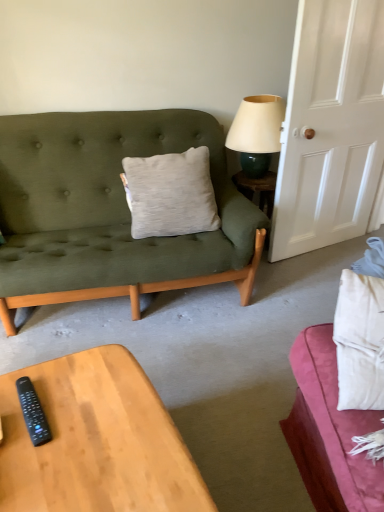
Image resolution: width=384 pixels, height=512 pixels. Find the location of `white matte door at right`. white matte door at right is located at coordinates (331, 127).

Locate an element on the screen. The image size is (384, 512). matte green glass lamp at upper right is located at coordinates [x=257, y=132].

Looking at this image, what is the approximate height of wooden coffee table at lower left?

wooden coffee table at lower left is 15.50 inches in height.

You are a GUI agent. You are given a task and a screenshot of the screen. Output one action in this format:
    pyautogui.click(x=<x>, y=<y>)
    Task: Click on the light gray cotton pillow at center
    The height and width of the screenshot is (512, 384).
    Given the screenshot: What is the action you would take?
    pyautogui.click(x=170, y=194)

Image resolution: width=384 pixels, height=512 pixels. Describe the element at coordinates (33, 412) in the screenshot. I see `black plastic remote at lower left` at that location.

Locate an element on the screen. white matte door at right is located at coordinates (331, 127).

Does white fabric studio couch at lower right have a greater height compared to black plastic remote at lower left?

Indeed, white fabric studio couch at lower right has a greater height compared to black plastic remote at lower left.

Is black plastic remote at lower left inside white fabric studio couch at lower right?

No, black plastic remote at lower left is not inside white fabric studio couch at lower right.

From the image's perspective, relative to black plastic remote at lower left, is white fabric studio couch at lower right above or below?

white fabric studio couch at lower right is situated higher than black plastic remote at lower left in the image.

Consider the image. Is white fabric studio couch at lower right next to black plastic remote at lower left?

white fabric studio couch at lower right and black plastic remote at lower left are clearly separated.

Looking at this image, can we say white matte door at right lies outside light gray cotton pillow at center?

Yes.

The height and width of the screenshot is (512, 384). What are the coordinates of `pillow below the white matte door at right (from the image's perspective)` in the screenshot? It's located at pos(170,194).

Does point (305, 224) appear closer or farther from the camera than point (181, 203)?

Point (305, 224) is positioned farther from the camera compared to point (181, 203).

In terms of width, does white matte door at right look wider or thinner when compared to light gray cotton pillow at center?

Clearly, white matte door at right has less width compared to light gray cotton pillow at center.

From the image's perspective, would you say light gray cotton pillow at center is positioned over white fabric studio couch at lower right?

Yes, from the image's perspective, light gray cotton pillow at center is over white fabric studio couch at lower right.

Looking at this image, which object is positioned more to the right, light gray cotton pillow at center or white fabric studio couch at lower right?

white fabric studio couch at lower right.

Considering the points (196, 180) and (351, 318), which point is in front, point (196, 180) or point (351, 318)?

The point (351, 318) is closer.

Is light gray cotton pillow at center located outside white fabric studio couch at lower right?

Yes, light gray cotton pillow at center is located beyond the bounds of white fabric studio couch at lower right.

Is matte green glass lamp at upper right completely or partially outside of light gray cotton pillow at center?

Yes.

From the image's perspective, would you say matte green glass lamp at upper right is positioned over light gray cotton pillow at center?

Indeed, from the image's perspective, matte green glass lamp at upper right is shown above light gray cotton pillow at center.

Which of these two, matte green glass lamp at upper right or light gray cotton pillow at center, is wider?

matte green glass lamp at upper right.

Visually, is matte green glass lamp at upper right positioned to the left or to the right of light gray cotton pillow at center?

matte green glass lamp at upper right is to the right of light gray cotton pillow at center.

Is light gray cotton pillow at center facing towards white matte door at right?

No, light gray cotton pillow at center is not turned towards white matte door at right.

From a real-world perspective, is light gray cotton pillow at center above or below white matte door at right?

light gray cotton pillow at center is below white matte door at right.

Is light gray cotton pillow at center smaller than white matte door at right?

Yes, light gray cotton pillow at center is smaller than white matte door at right.

Is wooden coffee table at lower left closer to camera compared to light gray cotton pillow at center?

Yes, wooden coffee table at lower left is closer to the camera.

What's the angular difference between wooden coffee table at lower left and light gray cotton pillow at center's facing directions?

There is a 70-degree angle between the facing directions of wooden coffee table at lower left and light gray cotton pillow at center.

Can we say wooden coffee table at lower left lies outside light gray cotton pillow at center?

That's correct, wooden coffee table at lower left is outside of light gray cotton pillow at center.

Considering the points (22, 483) and (182, 212), which point is in front, point (22, 483) or point (182, 212)?

The point (22, 483) is closer to the camera.

Which object is closer to the camera, white matte door at right or black plastic remote at lower left?

black plastic remote at lower left.

Is white matte door at right oriented away from black plastic remote at lower left?

No, black plastic remote at lower left is not at the back of white matte door at right.

Measure the distance from white matte door at right to black plastic remote at lower left.

A distance of 6.13 feet exists between white matte door at right and black plastic remote at lower left.

At what (x,y) coordinates should I click in order to perform the action: click on remote control to the left of white matte door at right. Please return your answer as a coordinate pair (x, y). Looking at the image, I should click on (33, 412).

What are the coordinates of `remote control located below the white fabric studio couch at lower right (from the image's perspective)` in the screenshot? It's located at (33, 412).

This screenshot has width=384, height=512. I want to click on door in front of the light gray cotton pillow at center, so click(x=331, y=127).

Based on their spatial positions, is wooden coffee table at lower left or white fabric studio couch at lower right further from light gray cotton pillow at center?

The object further to light gray cotton pillow at center is white fabric studio couch at lower right.

Looking at the image, which one is located closer to white matte door at right, matte green glass lamp at upper right or white fabric studio couch at lower right?

matte green glass lamp at upper right is closer to white matte door at right.

Which object lies further to the anchor point black plastic remote at lower left, light gray cotton pillow at center or wooden coffee table at lower left?

The object further to black plastic remote at lower left is light gray cotton pillow at center.

From the image, which object appears to be nearer to white fabric studio couch at lower right, matte green glass lamp at upper right or light gray cotton pillow at center?

light gray cotton pillow at center is positioned closer to the anchor white fabric studio couch at lower right.

From the image, which object appears to be farther from white matte door at right, black plastic remote at lower left or white fabric studio couch at lower right?

The object further to white matte door at right is black plastic remote at lower left.

From the picture: Which object lies nearer to the anchor point black plastic remote at lower left, white fabric studio couch at lower right or white matte door at right?

Among the two, white fabric studio couch at lower right is located nearer to black plastic remote at lower left.

Looking at the image, which one is located further to black plastic remote at lower left, light gray cotton pillow at center or white matte door at right?

white matte door at right is positioned further to the anchor black plastic remote at lower left.

Considering their positions, is black plastic remote at lower left positioned further to white fabric studio couch at lower right than matte green glass lamp at upper right?

The object further to white fabric studio couch at lower right is matte green glass lamp at upper right.

Locate an element on the screen. The height and width of the screenshot is (512, 384). remote control between wooden coffee table at lower left and light gray cotton pillow at center from front to back is located at coordinates (33, 412).

The image size is (384, 512). I want to click on remote control between white fabric studio couch at lower right and matte green glass lamp at upper right along the z-axis, so click(x=33, y=412).

The height and width of the screenshot is (512, 384). Identify the location of remote control between white fabric studio couch at lower right and light gray cotton pillow at center in the front-back direction. (33, 412).

Identify the location of pillow between wooden coffee table at lower left and matte green glass lamp at upper right along the z-axis. The width and height of the screenshot is (384, 512). tap(170, 194).